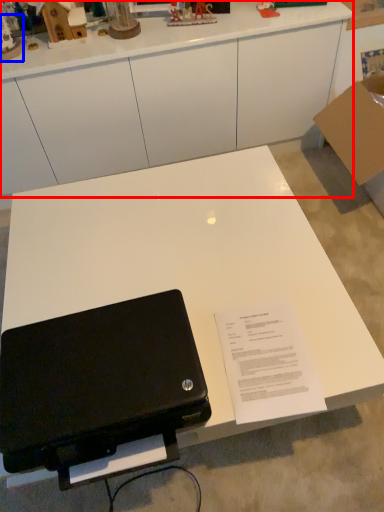
Question: Among these objects, which one is farthest to the camera, desk (highlighted by a red box) or toy (highlighted by a blue box)?

Choices:
 (A) desk
 (B) toy

Answer: (A)